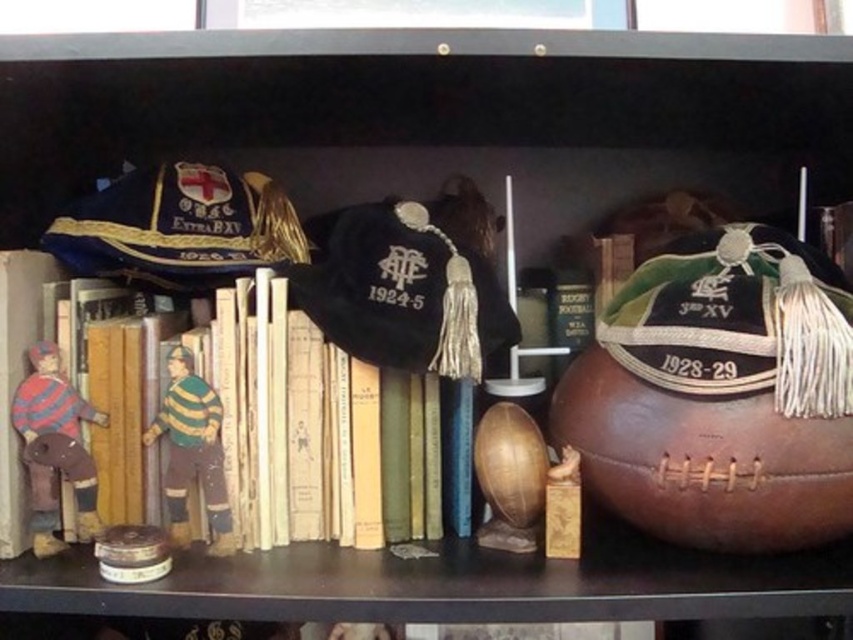
You are organizing a shelf and need to place a new item between the velvet green cap at right and the yellow paper book at center. Which item should be moved to make space?

The velvet green cap at right is positioned over the yellow paper book at center, so you should move the velvet green cap at right to make space for the new item.